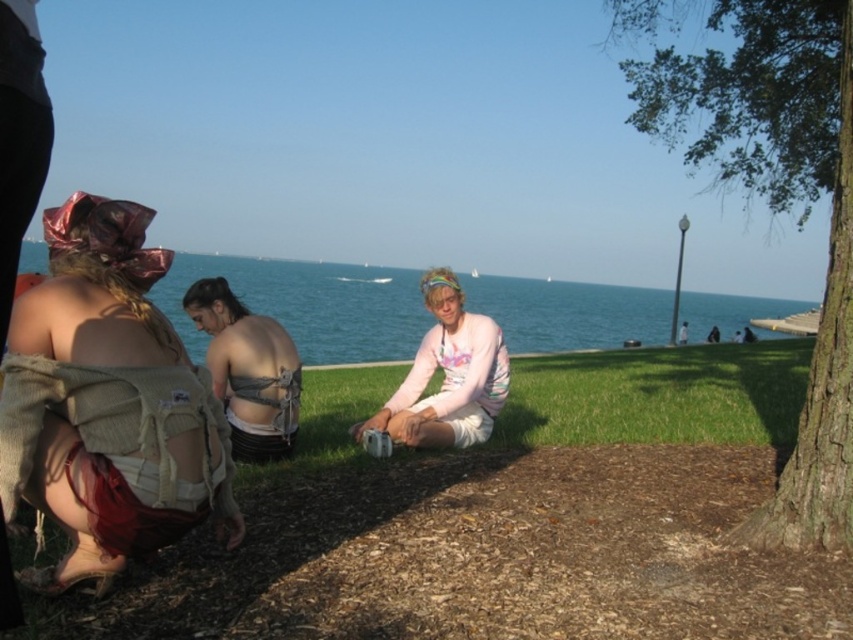
You are a photographer trying to capture a photo of the brown rough bark tree at center right and the matte gray fabric at center. Based on their positions, which object should you adjust your camera to focus on first if you want to ensure both are in the frame?

The brown rough bark tree at center right is to the right of matte gray fabric at center, so you should focus on the matte gray fabric at center first to ensure both are in the frame.

You are a photographer setting up a tripod at the lakeside park. You want to place the matte beige backpack at lower left and the brown rough bark tree at center right in your shot. Which object will appear smaller in the final photo?

The matte beige backpack at lower left will appear smaller in the final photo because it is shorter than the brown rough bark tree at center right.